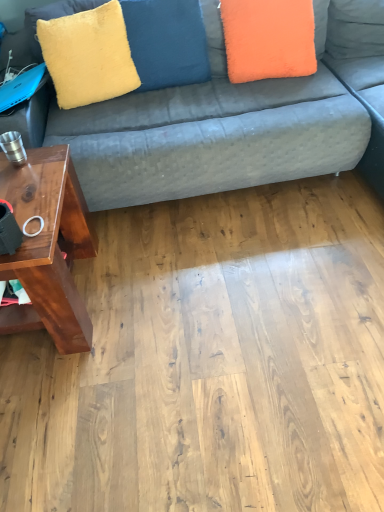
I want to click on vacant area that is situated to the right of brown wood table at left, so click(153, 288).